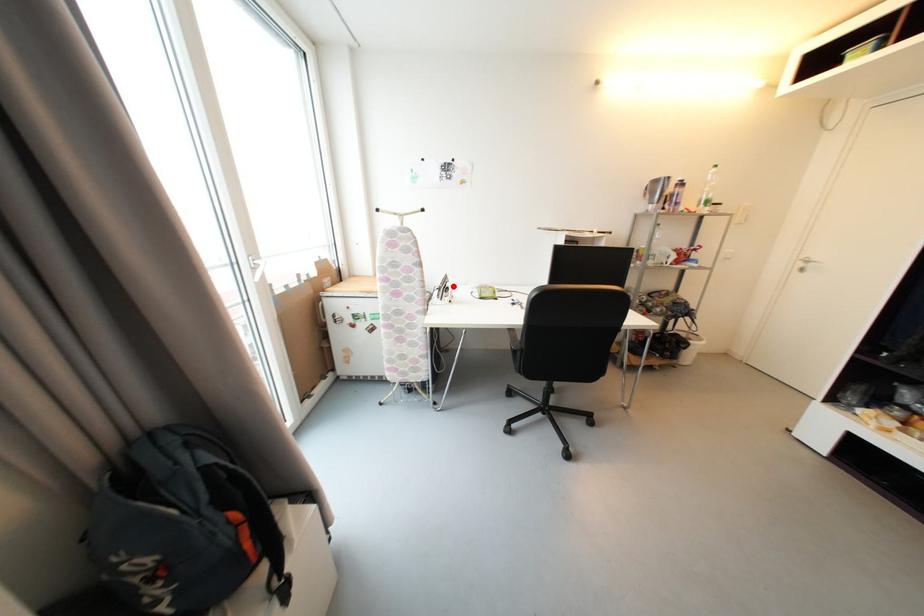
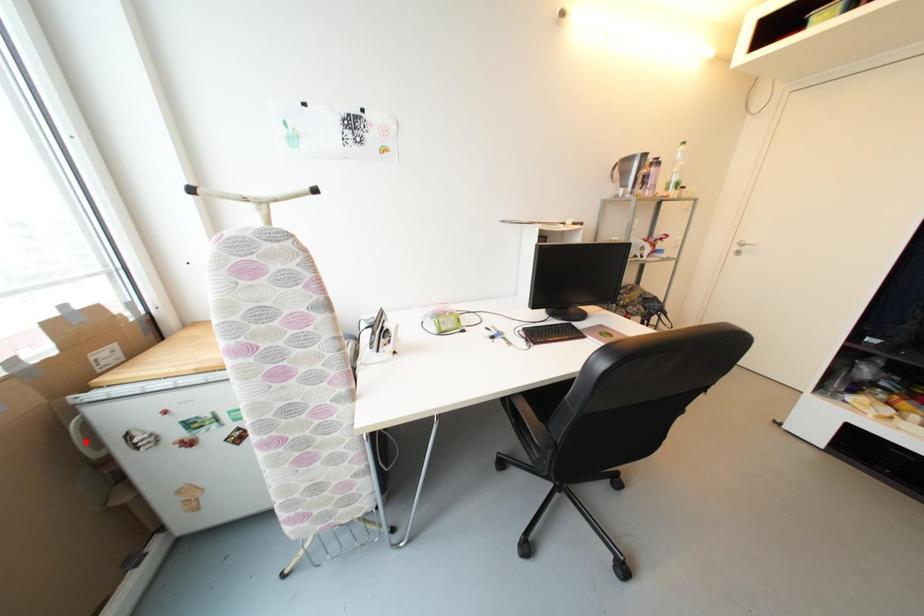
I am providing you with two images of the same scene from different viewpoints. A red point is marked on the first image and another point is marked on the second image. Is the red point in image1 aligned with the point shown in image2?

No